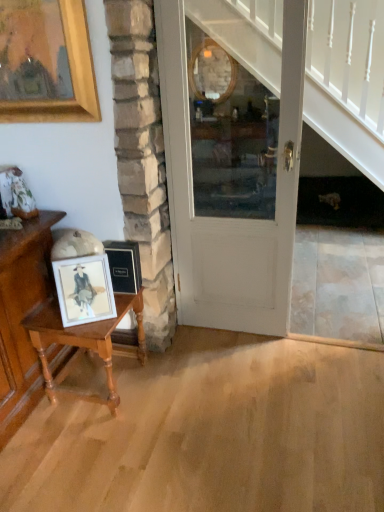
The image size is (384, 512). I want to click on free location to the right of wooden table at left, so click(x=172, y=385).